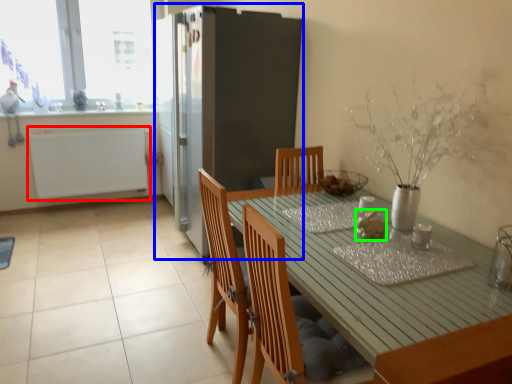
Question: Considering the real-world distances, which object is farthest from radiator (highlighted by a red box)? fridge (highlighted by a blue box) or food (highlighted by a green box)?

Choices:
 (A) fridge
 (B) food

Answer: (B)